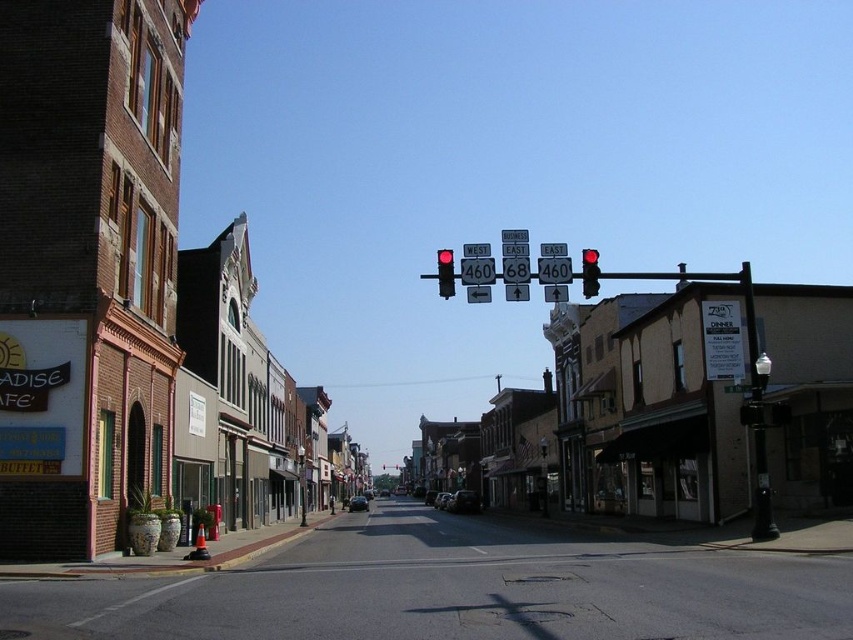
Is point (502, 624) less distant than point (592, 294)?

Yes.

Can you confirm if smooth asphalt road at center is wider than red glass traffic light at center?

No.

Which is behind, point (672, 592) or point (585, 284)?

Positioned behind is point (585, 284).

Find the location of `smooth asphalt road at center`. smooth asphalt road at center is located at coordinates (453, 589).

Can you confirm if smooth asphalt road at center is thinner than matte red traffic light at center?

No, smooth asphalt road at center is not thinner than matte red traffic light at center.

How distant is smooth asphalt road at center from matte red traffic light at center?

The distance of smooth asphalt road at center from matte red traffic light at center is 49.55 feet.

Where is `smooth asphalt road at center`? This screenshot has width=853, height=640. smooth asphalt road at center is located at coordinates (453, 589).

Is brick building at left bigger than matte red traffic light at center?

No, brick building at left is not bigger than matte red traffic light at center.

Does point (7, 348) come behind point (445, 257)?

No, (7, 348) is closer to viewer.

I want to click on brick building at left, so click(125, 300).